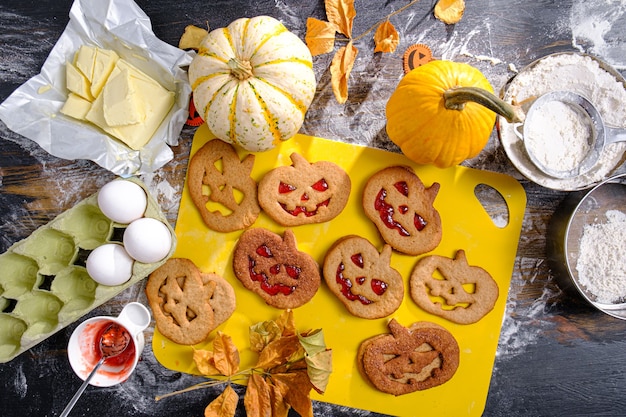
At what (x,y) coordinates should I click in order to perform the action: click on plastic white cup. Please return your answer as a coordinate pair (x, y). Looking at the image, I should click on click(x=134, y=336).